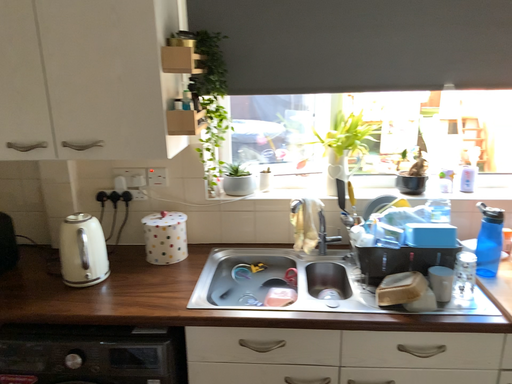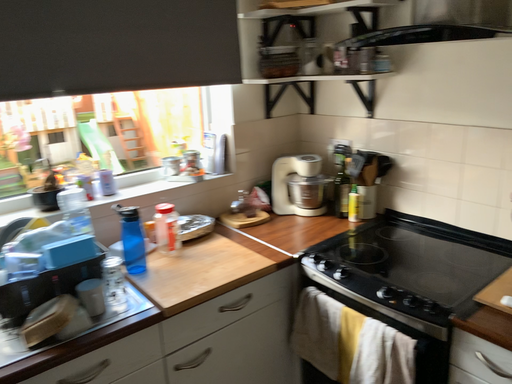
Question: Which way did the camera rotate in the video?

Choices:
 (A) rotated right
 (B) rotated left

Answer: (A)